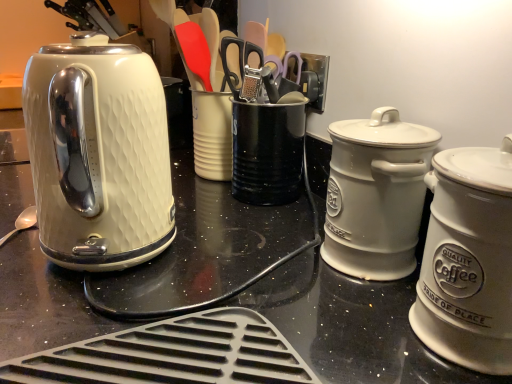
Question: Is matte white kettle at left taller or shorter than white ceramic canister at right, which is counted as the 2th kitchen appliance, starting from the back?

Choices:
 (A) tall
 (B) short

Answer: (A)

Question: From the image's perspective, is matte white kettle at left positioned above or below white ceramic canister at right, which is counted as the 2th kitchen appliance, starting from the back?

Choices:
 (A) above
 (B) below

Answer: (A)

Question: Considering the real-world distances, which object is farthest from the matte white kettle at left?

Choices:
 (A) white ceramic canister at right, which is counted as the 2th kitchen appliance, starting from the back
 (B) white ceramic canister at right, the second kitchen appliance in the front-to-back sequence
 (C) black metal canister at center
 (D) silver metallic spoon at lower left

Answer: (A)

Question: Based on their relative distances, which object is farther from the black metal canister at center?

Choices:
 (A) matte white kettle at left
 (B) white ceramic canister at right, the first kitchen appliance in the back-to-front sequence
 (C) white ceramic canister at right, which is counted as the 2th kitchen appliance, starting from the back
 (D) silver metallic spoon at lower left

Answer: (D)